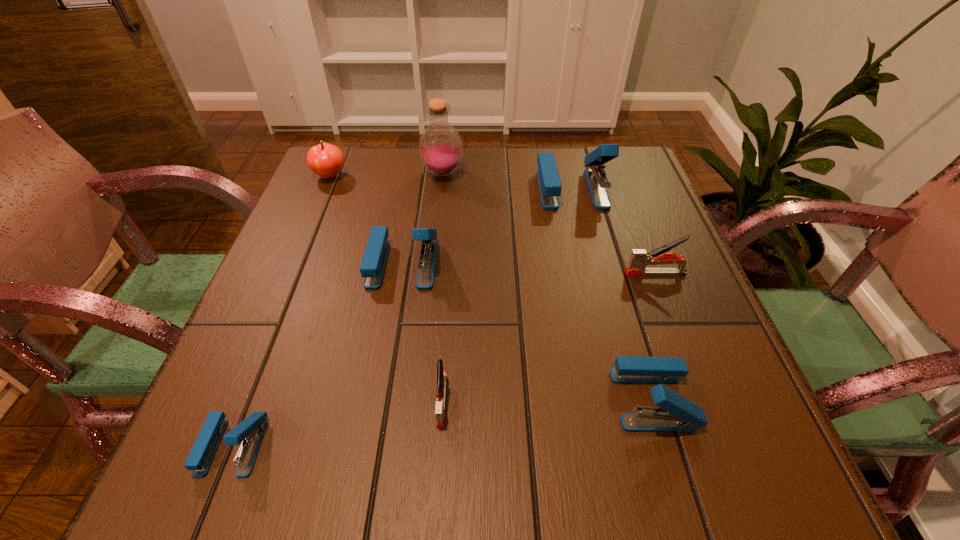
Locate which blue stapler ranks fourth in proximity to the right gray stapler. Please provide its 2D coordinates. Your answer should be formatted as a tuple, i.e. [(x, y)], where the tuple contains the x and y coordinates of a point satisfying the conditions above.

[(251, 431)]

Image resolution: width=960 pixels, height=540 pixels. Identify the location of blue stapler that stands as the closest to the leftmost stapler. pos(372,267).

Identify the location of vacant space that satisfies the following two spatial constraints: 1. on the front side of the leftmost stapler; 2. on the right side of the red apple. Image resolution: width=960 pixels, height=540 pixels. (216, 446).

This screenshot has width=960, height=540. Identify the location of free location that satisfies the following two spatial constraints: 1. on the handle side of the farther gray stapler; 2. on the handle side of the nearer gray stapler. (705, 401).

In order to click on free location that satisfies the following two spatial constraints: 1. on the back side of the farthest blue stapler; 2. on the right side of the leftmost stapler in this screenshot , I will do click(335, 188).

The image size is (960, 540). Find the location of `free location that satisfies the following two spatial constraints: 1. on the front side of the tallest object; 2. on the right side of the second tallest object`. free location that satisfies the following two spatial constraints: 1. on the front side of the tallest object; 2. on the right side of the second tallest object is located at coordinates (441, 188).

Where is `blank space that satisfies the following two spatial constraints: 1. on the front side of the biggest blue stapler; 2. on the right side of the second smallest blue stapler`? blank space that satisfies the following two spatial constraints: 1. on the front side of the biggest blue stapler; 2. on the right side of the second smallest blue stapler is located at coordinates (624, 399).

I want to click on blank space that satisfies the following two spatial constraints: 1. on the back side of the third nearest blue stapler; 2. on the left side of the purple bottle, so click(x=419, y=173).